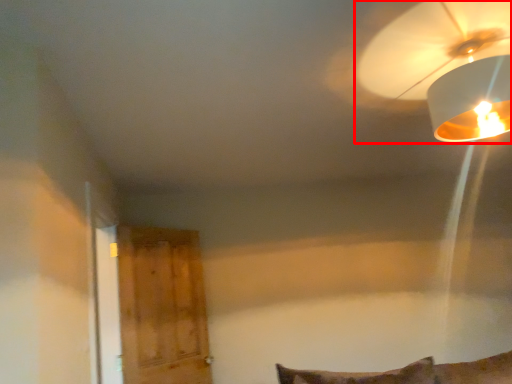
Question: From the image's perspective, what is the correct spatial relationship of lamp (annotated by the red box) in relation to glass door?

Choices:
 (A) above
 (B) below

Answer: (A)